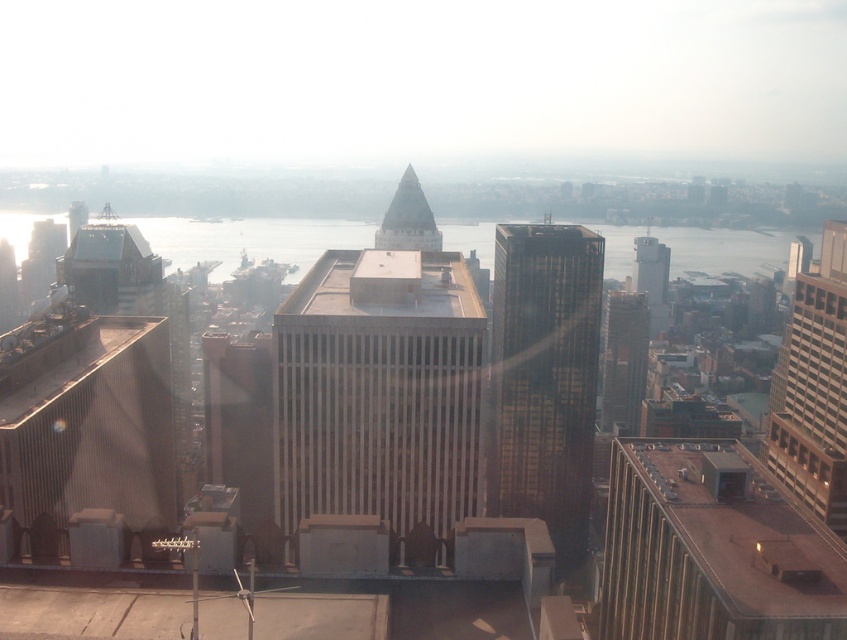
In the scene shown: You are standing on a balcony overlooking the city and see the glassy reflective skyscraper at center and the shiny glass spire at center. Which building is closer to you?

The glassy reflective skyscraper at center is closer to you because it is further to the viewer than the shiny glass spire at center.

You are standing at the base of the skyscraper and looking at the cityscape. There are two points marked in the image, point 1 at coordinates point (601, 403) and point 2 at coordinates point (414, 244). Which point is closer to you?

Point (414, 244) is closer to you because it is in front of point (601, 403).